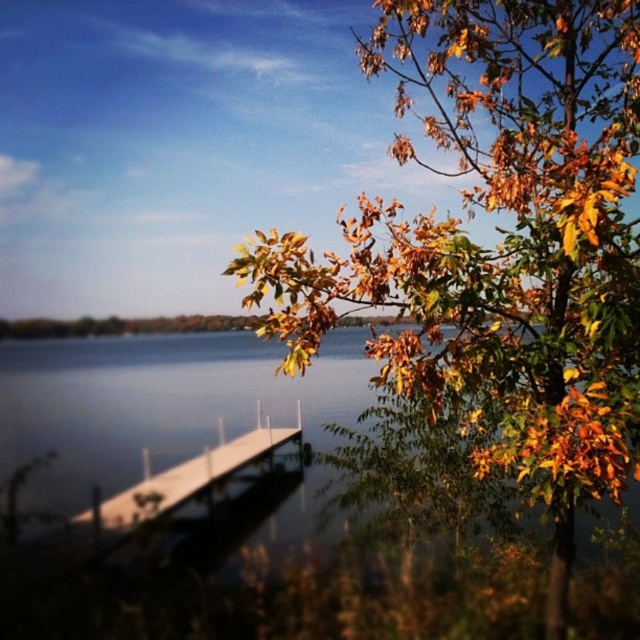
Can you confirm if golden leafy tree at upper right is wider than white wood dock at lower center?

Yes, golden leafy tree at upper right is wider than white wood dock at lower center.

Does golden leafy tree at upper right appear over white wood dock at lower center?

Correct, golden leafy tree at upper right is located above white wood dock at lower center.

Looking at this image, measure the distance between golden leafy tree at upper right and camera.

10.93 feet

The width and height of the screenshot is (640, 640). Identify the location of golden leafy tree at upper right. (500, 246).